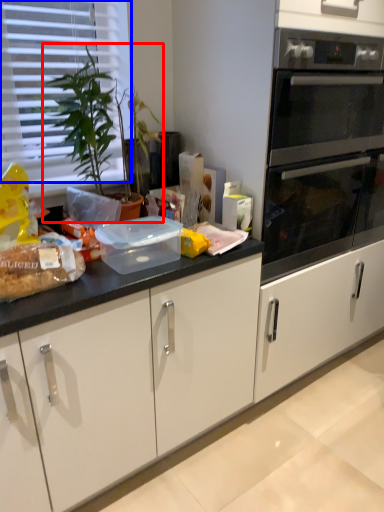
Question: Among these objects, which one is nearest to the camera, houseplant (highlighted by a red box) or blind (highlighted by a blue box)?

Choices:
 (A) houseplant
 (B) blind

Answer: (A)